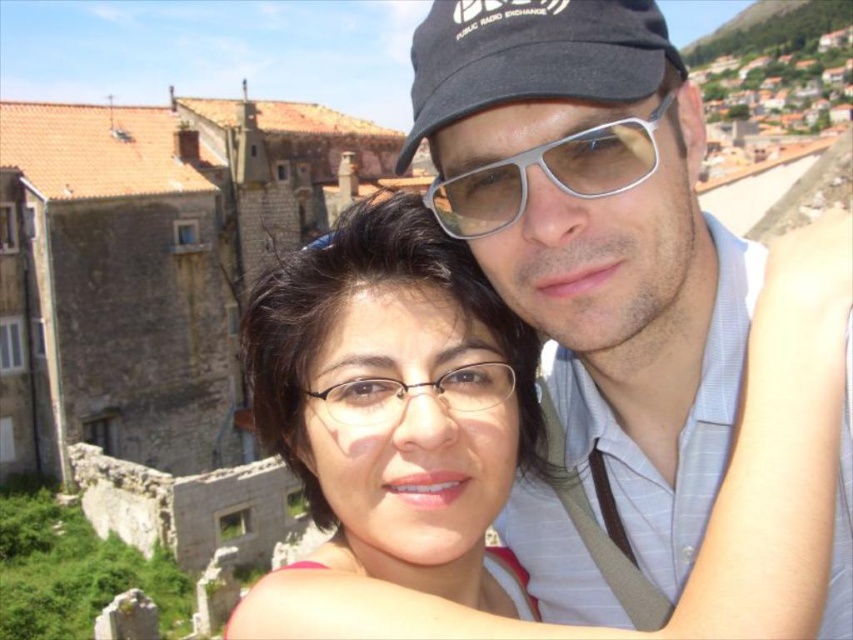
Question: Which object is positioned farthest from the matte black cap at upper center?

Choices:
 (A) silver metallic goggles at center
 (B) matte black hair at center

Answer: (B)

Question: Which of the following is the closest to the observer?

Choices:
 (A) (646, 132)
 (B) (334, 397)
 (C) (469, 513)
 (D) (624, 381)

Answer: (A)

Question: Observing the image, what is the correct spatial positioning of matte black hair at center in reference to silver metallic goggles at center?

Choices:
 (A) above
 (B) below

Answer: (B)

Question: Is matte black cap at upper center closer to the viewer compared to clear plastic glasses at center?

Choices:
 (A) yes
 (B) no

Answer: (A)

Question: Which is farther from the clear plastic glasses at center?

Choices:
 (A) silver metallic goggles at center
 (B) matte black cap at upper center
 (C) matte black hair at center

Answer: (A)

Question: Is the position of matte black cap at upper center less distant than that of silver metallic goggles at center?

Choices:
 (A) yes
 (B) no

Answer: (A)